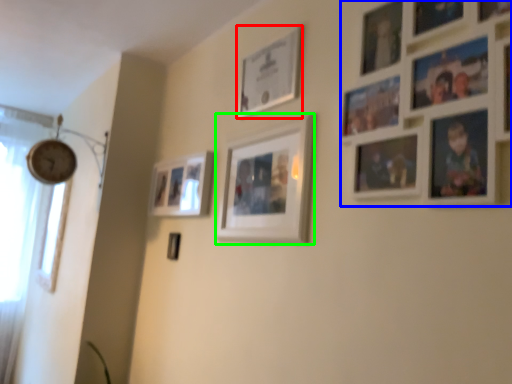
Question: Which is farther away from picture frame (highlighted by a red box)? picture frame (highlighted by a blue box) or picture frame (highlighted by a green box)?

Choices:
 (A) picture frame
 (B) picture frame

Answer: (A)